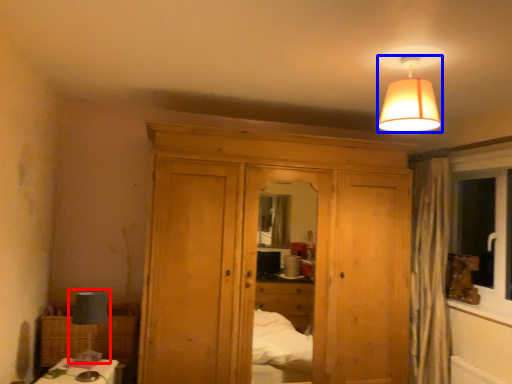
Question: Which object is further to the camera taking this photo, table lamp (highlighted by a red box) or lamp (highlighted by a blue box)?

Choices:
 (A) table lamp
 (B) lamp

Answer: (A)